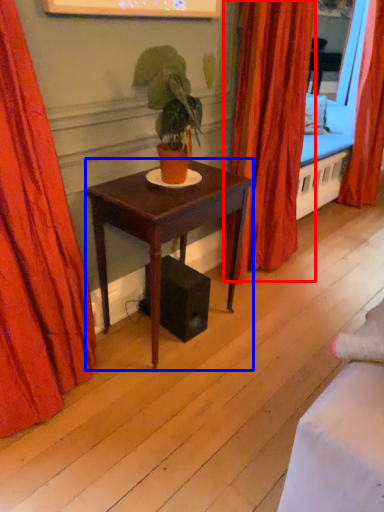
Question: Which object appears closest to the camera in this image, curtain (highlighted by a red box) or desk (highlighted by a blue box)?

Choices:
 (A) curtain
 (B) desk

Answer: (B)